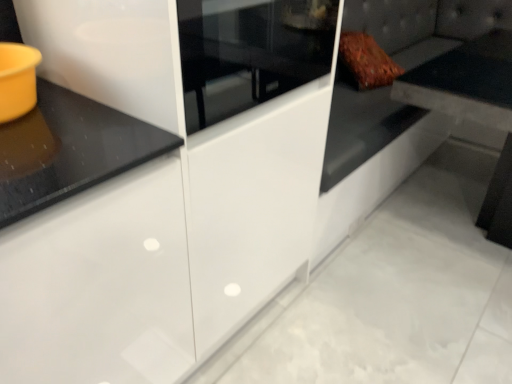
Question: Is matte black table at upper right touching leather couch at right?

Choices:
 (A) yes
 (B) no

Answer: (B)

Question: Is leather couch at right a part of matte black table at upper right?

Choices:
 (A) yes
 (B) no

Answer: (B)

Question: From a real-world perspective, is matte black table at upper right located higher than leather couch at right?

Choices:
 (A) yes
 (B) no

Answer: (A)

Question: Does matte black table at upper right have a greater height compared to leather couch at right?

Choices:
 (A) yes
 (B) no

Answer: (A)

Question: Can you confirm if matte black table at upper right is wider than leather couch at right?

Choices:
 (A) no
 (B) yes

Answer: (A)

Question: Is matte black table at upper right far away from leather couch at right?

Choices:
 (A) yes
 (B) no

Answer: (A)

Question: Considering the relative sizes of matte black table at upper right and white glossy cabinet at center in the image provided, is matte black table at upper right bigger than white glossy cabinet at center?

Choices:
 (A) no
 (B) yes

Answer: (A)

Question: Considering the relative sizes of matte black table at upper right and white glossy cabinet at center in the image provided, is matte black table at upper right shorter than white glossy cabinet at center?

Choices:
 (A) no
 (B) yes

Answer: (B)

Question: From a real-world perspective, is matte black table at upper right located beneath white glossy cabinet at center?

Choices:
 (A) yes
 (B) no

Answer: (A)

Question: Is matte black table at upper right taller than white glossy cabinet at center?

Choices:
 (A) no
 (B) yes

Answer: (A)

Question: Considering the relative sizes of matte black table at upper right and white glossy cabinet at center in the image provided, is matte black table at upper right smaller than white glossy cabinet at center?

Choices:
 (A) yes
 (B) no

Answer: (A)

Question: Is matte black table at upper right to the right of white glossy cabinet at center from the viewer's perspective?

Choices:
 (A) no
 (B) yes

Answer: (B)

Question: Are white glossy cabinet at center and matte black table at upper right far apart?

Choices:
 (A) no
 (B) yes

Answer: (B)